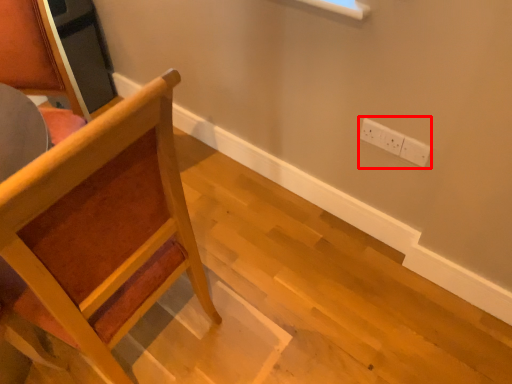
Question: Where is electric outlet (annotated by the red box) located in relation to chair in the image?

Choices:
 (A) left
 (B) right

Answer: (B)